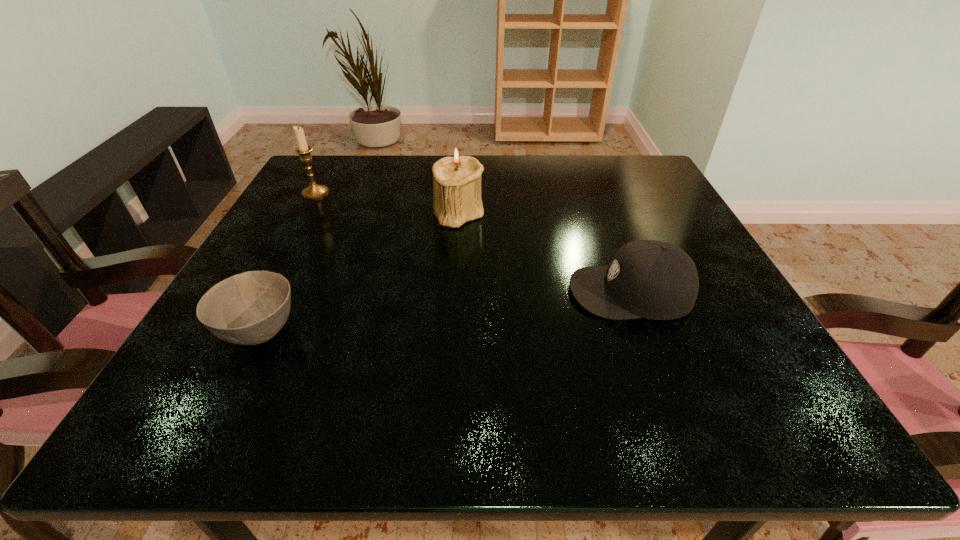
In the image, there is a desktop. What are the coordinates of `vacant region at the far right corner` in the screenshot? It's located at (604, 157).

This screenshot has height=540, width=960. Identify the location of vacant space at the near right corner of the desktop. (761, 391).

The width and height of the screenshot is (960, 540). I want to click on free space between the right candle_holder and the third tallest object, so click(x=544, y=252).

Find the location of a particular element. The height and width of the screenshot is (540, 960). blank region between the third tallest object and the right candle_holder is located at coordinates (544, 252).

At what (x,y) coordinates should I click in order to perform the action: click on vacant area that lies between the shortest object and the third object from left to right. Please return your answer as a coordinate pair (x, y). Looking at the image, I should click on click(x=359, y=272).

This screenshot has height=540, width=960. Identify the location of vacant region between the shortest object and the cap. point(445,312).

Image resolution: width=960 pixels, height=540 pixels. I want to click on free area in between the cap and the left candle_holder, so click(x=473, y=242).

At what (x,y) coordinates should I click in order to perform the action: click on unoccupied area between the second shortest object and the bowl. Please return your answer as a coordinate pair (x, y). This screenshot has height=540, width=960. Looking at the image, I should click on (445, 312).

The width and height of the screenshot is (960, 540). Identify the location of free space that is in between the right candle_holder and the rightmost object. click(544, 252).

What are the coordinates of `free space between the shortest object and the cap` in the screenshot? It's located at (445, 312).